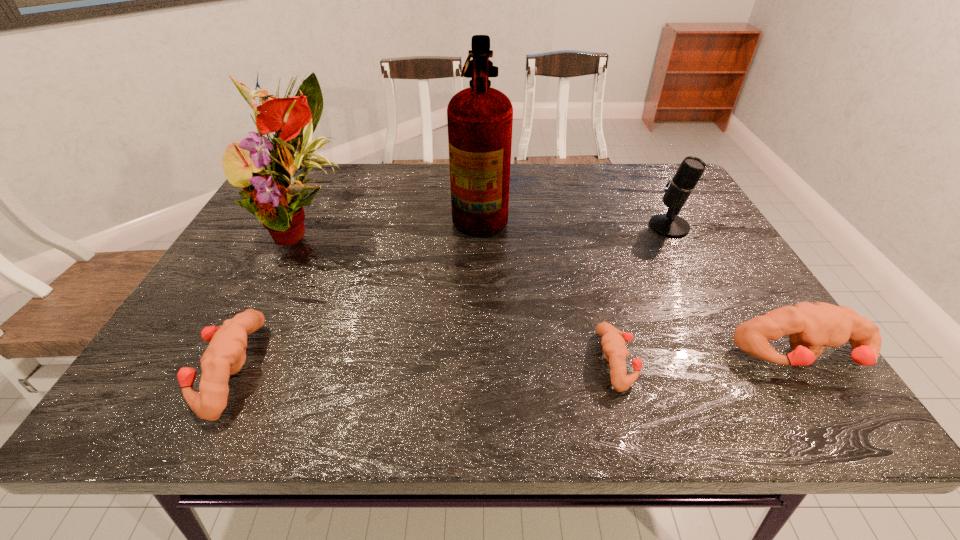
Where is `the second tallest puncher`? This screenshot has height=540, width=960. the second tallest puncher is located at coordinates (226, 354).

This screenshot has height=540, width=960. Identify the location of the leftmost puncher. (226, 354).

Identify the location of the third object from right to left. (613, 340).

The width and height of the screenshot is (960, 540). In order to click on the shortest object in this screenshot , I will do `click(613, 340)`.

Identify the location of the rightmost puncher. Image resolution: width=960 pixels, height=540 pixels. (811, 327).

The height and width of the screenshot is (540, 960). I want to click on the tallest object, so click(480, 118).

Find the location of a particular element. Image resolution: width=960 pixels, height=540 pixels. the fourth object from right to left is located at coordinates (480, 118).

Find the location of `bouquet`. bouquet is located at coordinates (277, 199).

Locate an element on the screen. the fourth shortest object is located at coordinates (678, 190).

The width and height of the screenshot is (960, 540). I want to click on vacant region located with the gloves of the leftmost puncher facing forward, so click(x=161, y=369).